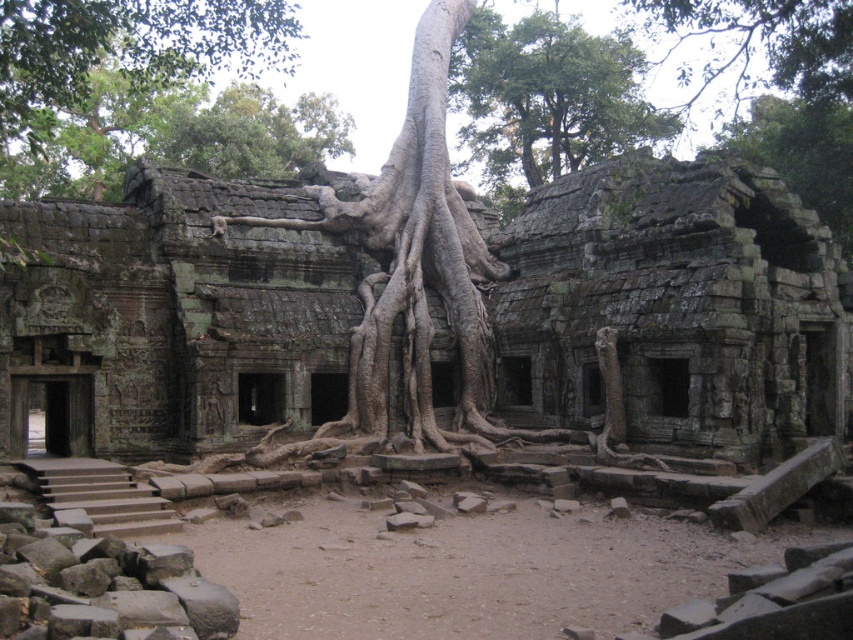
You are an archaeologist examining the ancient stone structure. You notice a specific point marked at coordinates (674,308). What object is located at this point?

The gray stone ruins at center are located at point (674,308).